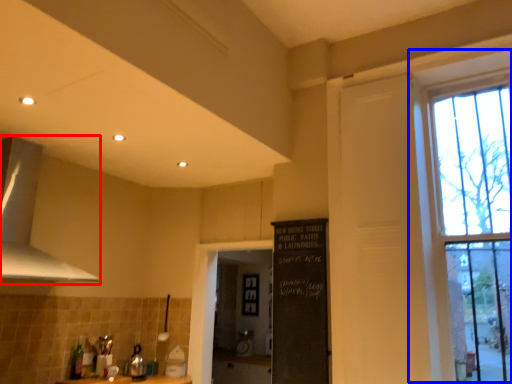
Question: Among these objects, which one is nearest to the camera, exhaust hood (highlighted by a red box) or window (highlighted by a blue box)?

Choices:
 (A) exhaust hood
 (B) window

Answer: (B)